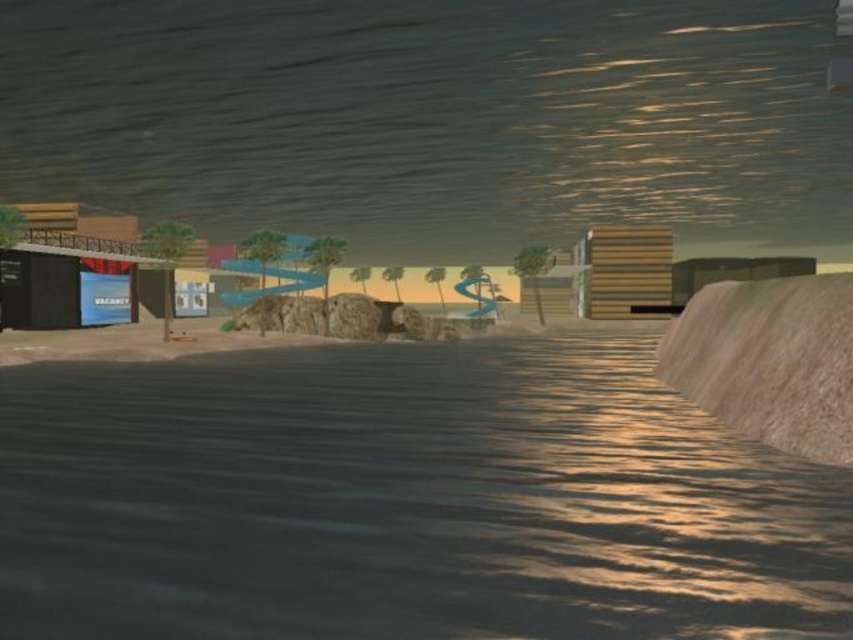
Is rustic wood ramp at right taller than blue glossy sign at lower left?

Incorrect, rustic wood ramp at right's height is not larger of blue glossy sign at lower left's.

Between rustic wood ramp at right and blue glossy sign at lower left, which one appears on the left side from the viewer's perspective?

From the viewer's perspective, blue glossy sign at lower left appears more on the left side.

I want to click on rustic wood ramp at right, so click(x=769, y=360).